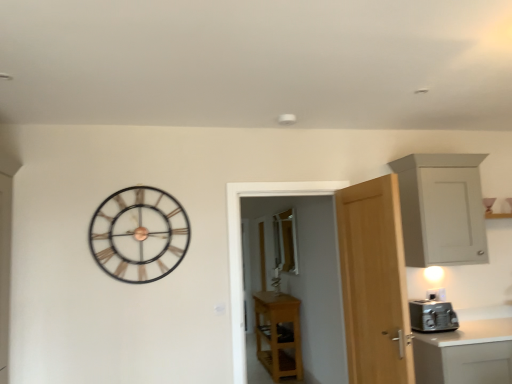
Locate an element on the screen. This screenshot has width=512, height=384. clear glass window at center is located at coordinates (285, 241).

Where is `clear glass window at center`? The width and height of the screenshot is (512, 384). clear glass window at center is located at coordinates (285, 241).

Is metallic silver toaster at right far away from light wood cabinet at center, the second cabinetry when ordered from right to left?

Yes.

Which of these two, metallic silver toaster at right or light wood cabinet at center, which is the first cabinetry in left-to-right order, is bigger?

light wood cabinet at center, which is the first cabinetry in left-to-right order, is bigger.

Find the location of a particular element. The height and width of the screenshot is (384, 512). the 2nd cabinetry behind the metallic silver toaster at right, counting from the anchor's position is located at coordinates (278, 334).

Is metallic silver toaster at right positioned beyond the bounds of light wood cabinet at center, which is the first cabinetry in back-to-front order?

Yes, metallic silver toaster at right is outside of light wood cabinet at center, which is the first cabinetry in back-to-front order.

Does light wood cabinet at center, arranged as the first cabinetry when ordered from the bottom, appear on the right side of white matte cabinet at upper right, the first cabinetry viewed from the right?

Incorrect, light wood cabinet at center, arranged as the first cabinetry when ordered from the bottom, is not on the right side of white matte cabinet at upper right, the first cabinetry viewed from the right.

Can you see light wood cabinet at center, which is the first cabinetry in back-to-front order, touching white matte cabinet at upper right, which is the 1th cabinetry in top-to-bottom order?

No, light wood cabinet at center, which is the first cabinetry in back-to-front order, is not touching white matte cabinet at upper right, which is the 1th cabinetry in top-to-bottom order.

Considering the relative sizes of light wood cabinet at center, the second cabinetry when ordered from right to left, and white matte cabinet at upper right, the 2th cabinetry from the left, in the image provided, is light wood cabinet at center, the second cabinetry when ordered from right to left, bigger than white matte cabinet at upper right, the 2th cabinetry from the left,?

Indeed, light wood cabinet at center, the second cabinetry when ordered from right to left, has a larger size compared to white matte cabinet at upper right, the 2th cabinetry from the left.

Considering the sizes of objects light wood cabinet at center, which is the first cabinetry in left-to-right order, and white matte cabinet at upper right, the 2th cabinetry ordered from the bottom, in the image provided, who is thinner, light wood cabinet at center, which is the first cabinetry in left-to-right order, or white matte cabinet at upper right, the 2th cabinetry ordered from the bottom,?

Thinner between the two is white matte cabinet at upper right, the 2th cabinetry ordered from the bottom.

Is metallic gold clock at upper left located outside light wood cabinet at center, arranged as the first cabinetry when ordered from the bottom?

Yes, metallic gold clock at upper left is located beyond the bounds of light wood cabinet at center, arranged as the first cabinetry when ordered from the bottom.

Does metallic gold clock at upper left come in front of light wood cabinet at center, which is the first cabinetry in back-to-front order?

Yes, it is in front of light wood cabinet at center, which is the first cabinetry in back-to-front order.

Is point (140, 198) positioned after point (298, 348)?

No, it is in front of (298, 348).

Considering the sizes of objects metallic gold clock at upper left and light wood cabinet at center, acting as the 2th cabinetry starting from the top, in the image provided, who is bigger, metallic gold clock at upper left or light wood cabinet at center, acting as the 2th cabinetry starting from the top,?

light wood cabinet at center, acting as the 2th cabinetry starting from the top.

Where is `wall clock on the left of light wood cabinet at center, which is the first cabinetry in left-to-right order`? wall clock on the left of light wood cabinet at center, which is the first cabinetry in left-to-right order is located at coordinates pos(139,234).

Could you measure the distance between light wood cabinet at center, which is the first cabinetry in left-to-right order, and metallic gold clock at upper left?

A distance of 2.94 meters exists between light wood cabinet at center, which is the first cabinetry in left-to-right order, and metallic gold clock at upper left.

Is light wood cabinet at center, which is the first cabinetry in back-to-front order, taller than metallic gold clock at upper left?

Yes.

Which object is thinner, light wood cabinet at center, which is the first cabinetry in back-to-front order, or metallic gold clock at upper left?

metallic gold clock at upper left.

Does point (477, 240) appear closer or farther from the camera than point (149, 200)?

Clearly, point (477, 240) is more distant from the camera than point (149, 200).

In the scene shown: Is white matte cabinet at upper right, marked as the second cabinetry in a back-to-front arrangement, in contact with metallic gold clock at upper left?

No, white matte cabinet at upper right, marked as the second cabinetry in a back-to-front arrangement, is not touching metallic gold clock at upper left.

Who is more distant, white matte cabinet at upper right, which is the 1th cabinetry in top-to-bottom order, or metallic gold clock at upper left?

white matte cabinet at upper right, which is the 1th cabinetry in top-to-bottom order, is more distant.

Can you tell me how much white matte cabinet at upper right, the 2th cabinetry ordered from the bottom, and metallic gold clock at upper left differ in facing direction?

0.682 degrees.

Is white matte cabinet at upper right, marked as the second cabinetry in a back-to-front arrangement, facing away from clear glass window at center?

Absolutely, white matte cabinet at upper right, marked as the second cabinetry in a back-to-front arrangement, is directed away from clear glass window at center.

Which of these two, white matte cabinet at upper right, marked as the second cabinetry in a back-to-front arrangement, or clear glass window at center, is wider?

white matte cabinet at upper right, marked as the second cabinetry in a back-to-front arrangement.

How different are the orientations of white matte cabinet at upper right, marked as the second cabinetry in a back-to-front arrangement, and clear glass window at center in degrees?

white matte cabinet at upper right, marked as the second cabinetry in a back-to-front arrangement, and clear glass window at center are facing 91.2 degrees away from each other.

Is white matte cabinet at upper right, the 2th cabinetry ordered from the bottom, not close to clear glass window at center?

Yes, white matte cabinet at upper right, the 2th cabinetry ordered from the bottom, and clear glass window at center are located far from each other.

Looking at this image, is metallic gold clock at upper left far from white matte cabinet at upper right, the 2th cabinetry ordered from the bottom?

That's right, there is a large distance between metallic gold clock at upper left and white matte cabinet at upper right, the 2th cabinetry ordered from the bottom.

Between point (128, 252) and point (404, 217), which one is positioned in front?

Point (128, 252)

Considering the sizes of metallic gold clock at upper left and white matte cabinet at upper right, which is the 1th cabinetry in front-to-back order, in the image, is metallic gold clock at upper left bigger or smaller than white matte cabinet at upper right, which is the 1th cabinetry in front-to-back order,?

Considering their sizes, metallic gold clock at upper left takes up less space than white matte cabinet at upper right, which is the 1th cabinetry in front-to-back order.

Is metallic gold clock at upper left aimed at white matte cabinet at upper right, which is the 1th cabinetry in top-to-bottom order?

No.

Locate an element on the screen. Image resolution: width=512 pixels, height=384 pixels. the 2nd cabinetry behind the metallic silver toaster at right is located at coordinates (278, 334).

At what (x,y) coordinates should I click in order to perform the action: click on cabinetry above the light wood cabinet at center, which is the first cabinetry in left-to-right order (from a real-world perspective). Please return your answer as a coordinate pair (x, y). Image resolution: width=512 pixels, height=384 pixels. Looking at the image, I should click on pyautogui.click(x=441, y=209).

When comparing their distances from light wood door at right, does metallic gold clock at upper left or clear glass window at center seem further?

clear glass window at center is positioned further to the anchor light wood door at right.

Considering their positions, is white matte cabinet at upper right, the 2th cabinetry ordered from the bottom, positioned further to metallic gold clock at upper left than light wood door at right?

white matte cabinet at upper right, the 2th cabinetry ordered from the bottom, lies further to metallic gold clock at upper left than the other object.

Based on their spatial positions, is metallic gold clock at upper left or white matte cabinet at upper right, marked as the second cabinetry in a back-to-front arrangement, further from clear glass window at center?

metallic gold clock at upper left is positioned further to the anchor clear glass window at center.

From the image, which object appears to be nearer to metallic silver toaster at right, light wood cabinet at center, which is the first cabinetry in back-to-front order, or light wood door at right?

Based on the image, light wood door at right appears to be nearer to metallic silver toaster at right.

Which object lies nearer to the anchor point light wood cabinet at center, arranged as the first cabinetry when ordered from the bottom, metallic gold clock at upper left or clear glass window at center?

clear glass window at center is positioned closer to the anchor light wood cabinet at center, arranged as the first cabinetry when ordered from the bottom.

Considering their positions, is light wood door at right positioned further to light wood cabinet at center, which is the first cabinetry in left-to-right order, than metallic silver toaster at right?

Among the two, light wood door at right is located further to light wood cabinet at center, which is the first cabinetry in left-to-right order.

Which object lies further to the anchor point metallic silver toaster at right, white matte cabinet at upper right, the 2th cabinetry from the left, or light wood cabinet at center, arranged as the first cabinetry when ordered from the bottom?

light wood cabinet at center, arranged as the first cabinetry when ordered from the bottom, is positioned further to the anchor metallic silver toaster at right.

When comparing their distances from metallic silver toaster at right, does metallic gold clock at upper left or light wood door at right seem further?

metallic gold clock at upper left lies further to metallic silver toaster at right than the other object.

Locate an element on the screen. appliance between metallic gold clock at upper left and white matte cabinet at upper right, the 2th cabinetry from the left, from left to right is located at coordinates (432, 316).

At what (x,y) coordinates should I click in order to perform the action: click on door between metallic gold clock at upper left and metallic silver toaster at right in the horizontal direction. Please return your answer as a coordinate pair (x, y). Looking at the image, I should click on (374, 282).

Locate an element on the screen. appliance between light wood door at right and clear glass window at center in the front-back direction is located at coordinates (432, 316).

Where is `door between white matte cabinet at upper right, which is the 1th cabinetry in front-to-back order, and metallic silver toaster at right from top to bottom`? This screenshot has width=512, height=384. door between white matte cabinet at upper right, which is the 1th cabinetry in front-to-back order, and metallic silver toaster at right from top to bottom is located at coordinates (374, 282).